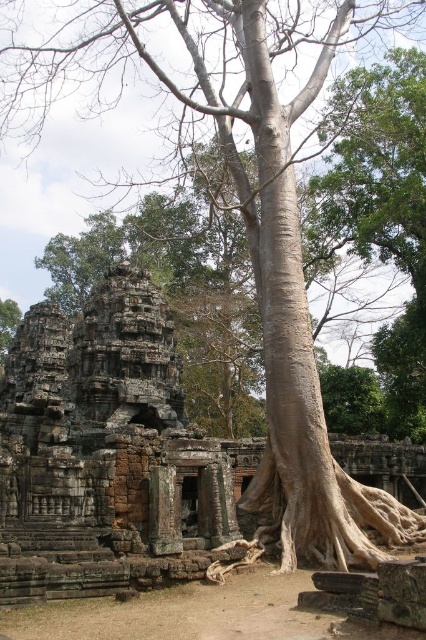
Question: Is brown stone ruins at center smaller than brown rough tree root at center?

Choices:
 (A) no
 (B) yes

Answer: (A)

Question: Which object is closer to the camera taking this photo?

Choices:
 (A) brown rough tree root at center
 (B) brown stone ruins at center

Answer: (B)

Question: Is brown stone ruins at center thinner than brown rough tree root at center?

Choices:
 (A) yes
 (B) no

Answer: (B)

Question: Can you confirm if brown stone ruins at center is thinner than brown rough tree root at center?

Choices:
 (A) no
 (B) yes

Answer: (A)

Question: Which point appears closest to the camera in this image?

Choices:
 (A) (135, 436)
 (B) (218, 566)

Answer: (B)

Question: Which of the following is the farthest from the observer?

Choices:
 (A) (226, 544)
 (B) (85, 339)

Answer: (B)